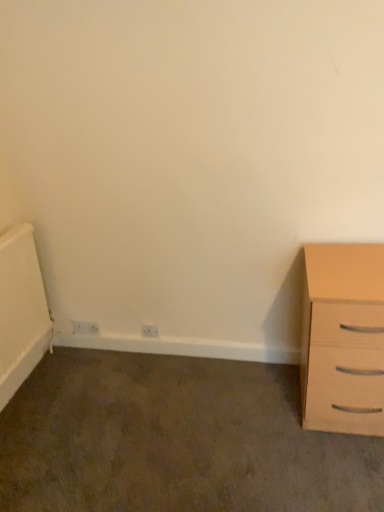
Question: Could white plastic electric outlet at lower left, which ranks as the 2th electric outlet in right-to-left order, be considered to be inside light wood chest of drawers at right?

Choices:
 (A) yes
 (B) no

Answer: (B)

Question: Does light wood chest of drawers at right lie in front of white plastic electric outlet at lower left, the 2th electric outlet in the front-to-back sequence?

Choices:
 (A) yes
 (B) no

Answer: (A)

Question: Is light wood chest of drawers at right thinner than white plastic electric outlet at lower left, which ranks as the 2th electric outlet in right-to-left order?

Choices:
 (A) no
 (B) yes

Answer: (A)

Question: Is light wood chest of drawers at right oriented towards white plastic electric outlet at lower left, which ranks as the 2th electric outlet in right-to-left order?

Choices:
 (A) no
 (B) yes

Answer: (A)

Question: Can you confirm if light wood chest of drawers at right is taller than white plastic electric outlet at lower left, which ranks as the first electric outlet in left-to-right order?

Choices:
 (A) yes
 (B) no

Answer: (A)

Question: Is light wood chest of drawers at right wider or thinner than white plastic electric outlet at lower left, which ranks as the first electric outlet in left-to-right order?

Choices:
 (A) wide
 (B) thin

Answer: (A)

Question: Is point (342, 303) positioned closer to the camera than point (87, 322)?

Choices:
 (A) farther
 (B) closer

Answer: (B)

Question: In the image, is light wood chest of drawers at right on the left side or the right side of white plastic electric outlet at lower left, which is the first electric outlet in back-to-front order?

Choices:
 (A) right
 (B) left

Answer: (A)

Question: From a real-world perspective, is light wood chest of drawers at right physically located above or below white plastic electric outlet at lower left, the 2th electric outlet in the front-to-back sequence?

Choices:
 (A) above
 (B) below

Answer: (A)

Question: From the image's perspective, is white plastic electric outlet at lower left, which is the first electric outlet in back-to-front order, positioned above or below light wood chest of drawers at right?

Choices:
 (A) above
 (B) below

Answer: (B)

Question: Based on their positions, is white plastic electric outlet at lower left, which is the first electric outlet in back-to-front order, located to the left or right of light wood chest of drawers at right?

Choices:
 (A) left
 (B) right

Answer: (A)

Question: From a real-world perspective, is white plastic electric outlet at lower left, which is the first electric outlet in back-to-front order, above or below light wood chest of drawers at right?

Choices:
 (A) below
 (B) above

Answer: (A)

Question: Considering the positions of white plastic electric outlet at lower left, which ranks as the first electric outlet in left-to-right order, and light wood chest of drawers at right in the image, is white plastic electric outlet at lower left, which ranks as the first electric outlet in left-to-right order, bigger or smaller than light wood chest of drawers at right?

Choices:
 (A) big
 (B) small

Answer: (B)

Question: Is point (153, 324) positioned closer to the camera than point (87, 322)?

Choices:
 (A) farther
 (B) closer

Answer: (B)

Question: Choose the correct answer: Is white plastic electric outlet at lower center, which appears as the second electric outlet when viewed from the back, inside white plastic electric outlet at lower left, which ranks as the first electric outlet in left-to-right order, or outside it?

Choices:
 (A) inside
 (B) outside

Answer: (B)